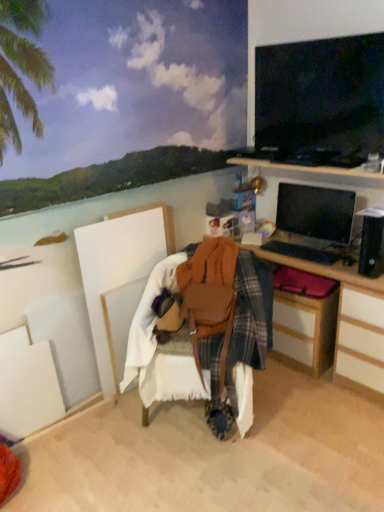
What is the approximate width of black glossy tv at upper right?

2.24 inches.

Where is `leather at center`? leather at center is located at coordinates click(203, 336).

This screenshot has height=512, width=384. Identify the location of wooden desk at center. (351, 323).

What is the approximate width of wooden desk at center?

The width of wooden desk at center is 20.24 inches.

In order to face matte black monitor at right, should I rotate leftwards or rightwards?

Turn right approximately 15.977 degrees to face it.

What do you see at coordinates (315, 212) in the screenshot?
I see `matte black monitor at right` at bounding box center [315, 212].

You are a GUI agent. You are given a task and a screenshot of the screen. Output one action in this format:
    pyautogui.click(x=<x>, y=<y>)
    Task: Click on the black glossy tv at upper right
    Image resolution: width=384 pixels, height=512 pixels.
    Given the screenshot: What is the action you would take?
    pyautogui.click(x=321, y=96)

Does point (256, 89) lie behind point (279, 198)?

No, it is not.

From the image's perspective, which object appears higher, black glossy tv at upper right or matte black monitor at right?

black glossy tv at upper right, from the image's perspective.

Would you say black glossy tv at upper right is a long distance from matte black monitor at right?

No, black glossy tv at upper right is not far away from matte black monitor at right.

Identify the location of television that appears behind the leather at center. The image size is (384, 512). (321, 96).

Considering the positions of point (242, 422) and point (265, 140), is point (242, 422) closer or farther from the camera than point (265, 140)?

Point (242, 422) is positioned closer to the camera compared to point (265, 140).

From the image's perspective, is leather at center under black glossy tv at upper right?

Yes, from the image's perspective, leather at center is beneath black glossy tv at upper right.

Could you tell me if leather at center is facing black glossy tv at upper right?

No.

From a real-world perspective, is black glossy tv at upper right on top of leather at center?

Indeed, from a real-world perspective, black glossy tv at upper right stands above leather at center.

Is black glossy tv at upper right further to the viewer compared to leather at center?

That is True.

Is point (361, 155) farther from viewer compared to point (200, 274)?

No, (361, 155) is in front of (200, 274).

This screenshot has width=384, height=512. In order to click on television behind the leather at center in this screenshot , I will do `click(321, 96)`.

Considering the sizes of leather at center and plaid fabric drawer at right in the image, is leather at center bigger or smaller than plaid fabric drawer at right?

leather at center is bigger than plaid fabric drawer at right.

Which of these two, leather at center or plaid fabric drawer at right, stands taller?

leather at center is taller.

Is leather at center aimed at plaid fabric drawer at right?

No, leather at center is not oriented towards plaid fabric drawer at right.

Considering the relative positions of plaid fabric drawer at right and black glossy tv at upper right in the image provided, is plaid fabric drawer at right to the left or to the right of black glossy tv at upper right?

Clearly, plaid fabric drawer at right is on the left of black glossy tv at upper right in the image.

Which of these two, plaid fabric drawer at right or black glossy tv at upper right, is bigger?

plaid fabric drawer at right.

Considering the relative sizes of plaid fabric drawer at right and black glossy tv at upper right in the image provided, is plaid fabric drawer at right wider than black glossy tv at upper right?

Yes, plaid fabric drawer at right is wider than black glossy tv at upper right.

Who is taller, plaid fabric drawer at right or leather at center?

leather at center.

From a real-world perspective, which is physically above, plaid fabric drawer at right or leather at center?

leather at center, from a real-world perspective.

This screenshot has width=384, height=512. I want to click on chair in front of the plaid fabric drawer at right, so (x=203, y=336).

Can you confirm if plaid fabric drawer at right is bigger than wooden desk at center?

No, plaid fabric drawer at right is not bigger than wooden desk at center.

In the image, is plaid fabric drawer at right positioned in front of or behind wooden desk at center?

plaid fabric drawer at right is behind wooden desk at center.

How many degrees apart are the facing directions of plaid fabric drawer at right and wooden desk at center?

plaid fabric drawer at right and wooden desk at center are facing 1.79 degrees away from each other.

From a real-world perspective, which object stands above the other?

wooden desk at center, from a real-world perspective.

In order to click on television positioned vertically above the matte black monitor at right (from a real-world perspective) in this screenshot , I will do `click(321, 96)`.

At what (x,y) coordinates should I click in order to perform the action: click on chair on the left of black glossy tv at upper right. Please return your answer as a coordinate pair (x, y). This screenshot has width=384, height=512. Looking at the image, I should click on (203, 336).

From the image, which object appears to be nearer to black glossy tv at upper right, leather at center or wooden desk at center?

wooden desk at center is closer to black glossy tv at upper right.

Considering their positions, is plaid fabric drawer at right positioned further to wooden desk at center than matte black monitor at right?

matte black monitor at right is positioned further to the anchor wooden desk at center.

Based on their spatial positions, is leather at center or wooden desk at center closer to plaid fabric drawer at right?

The object closer to plaid fabric drawer at right is wooden desk at center.

When comparing their distances from plaid fabric drawer at right, does matte black monitor at right or black glossy tv at upper right seem further?

black glossy tv at upper right is positioned further to the anchor plaid fabric drawer at right.

In the scene shown: Looking at the image, which one is located further to leather at center, plaid fabric drawer at right or black glossy tv at upper right?

Based on the image, black glossy tv at upper right appears to be further to leather at center.

Estimate the real-world distances between objects in this image. Which object is further from black glossy tv at upper right, leather at center or plaid fabric drawer at right?

leather at center is further to black glossy tv at upper right.

When comparing their distances from black glossy tv at upper right, does wooden desk at center or matte black monitor at right seem further?

wooden desk at center.

Looking at the image, which one is located further to matte black monitor at right, black glossy tv at upper right or wooden desk at center?

The object further to matte black monitor at right is black glossy tv at upper right.

I want to click on drawer between black glossy tv at upper right and leather at center from top to bottom, so click(x=305, y=330).

Image resolution: width=384 pixels, height=512 pixels. I want to click on desk between matte black monitor at right and plaid fabric drawer at right from top to bottom, so click(351, 323).

Identify the location of desk between leather at center and matte black monitor at right. The width and height of the screenshot is (384, 512). (351, 323).

At what (x,y) coordinates should I click in order to perform the action: click on drawer between leather at center and wooden desk at center in the horizontal direction. Please return your answer as a coordinate pair (x, y). The height and width of the screenshot is (512, 384). Looking at the image, I should click on (305, 330).